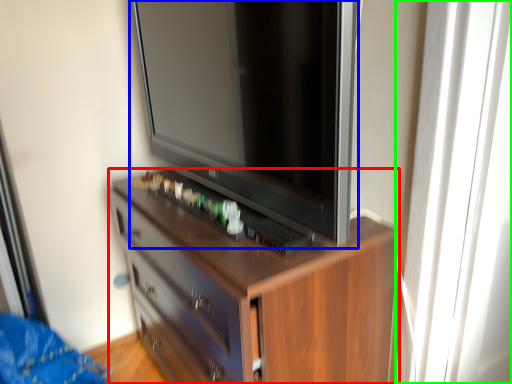
Question: Which is farther away from chest of drawers (highlighted by a red box)? television (highlighted by a blue box) or glass door (highlighted by a green box)?

Choices:
 (A) television
 (B) glass door

Answer: (B)